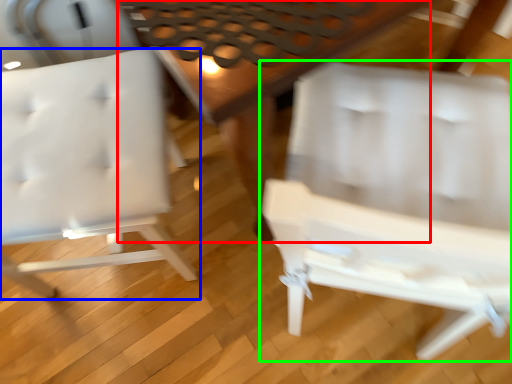
Question: Estimate the real-world distances between objects in this image. Which object is farther from table (highlighted by a red box), chair (highlighted by a blue box) or chair (highlighted by a green box)?

Choices:
 (A) chair
 (B) chair

Answer: (A)